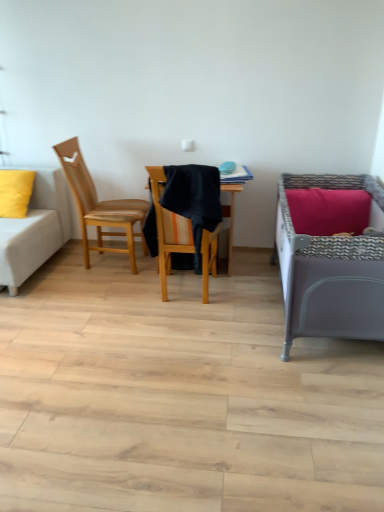
You are a GUI agent. You are given a task and a screenshot of the screen. Output one action in this format:
    pyautogui.click(x=<x>, y=<y>)
    Task: Click on the free space in front of wooden chair at center, the first chair positioned from the right
    
    Given the screenshot: What is the action you would take?
    pyautogui.click(x=183, y=330)